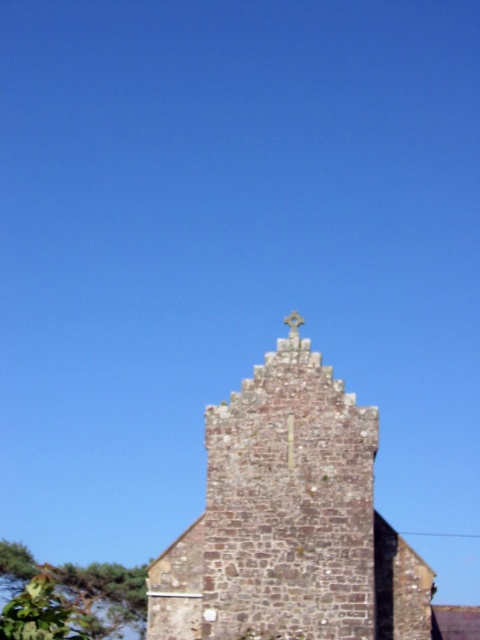
You are standing 100 meters away from the stone structure. A point labeled as point [214,596] is marked on the structure. If you move forward 30 meters towards the structure, will you be closer than 70.30 meters to the point?

The distance of point [214,596] from viewer is 70.30 meters. Moving forward 30 meters reduces the distance to 70.30 meters minus 30 meters, which equals 40.30 meters. Since 40.30 meters is less than 70.30 meters, you will be closer than 70.30 meters to the point.

You are an architect examining the upper part of a historic building. You notice the brown stone tower at center and the white stone cross at center. Based on their positions, which object is more to the left?

The brown stone tower at center is positioned on the left side of the white stone cross at center, so it is more to the left.

You are standing in front of the historic structure depicted in the image. You notice the brown stone tower at center and the white stone cross at center. Which object is positioned higher up in the image?

The white stone cross at center is positioned higher up in the image than the brown stone tower at center.